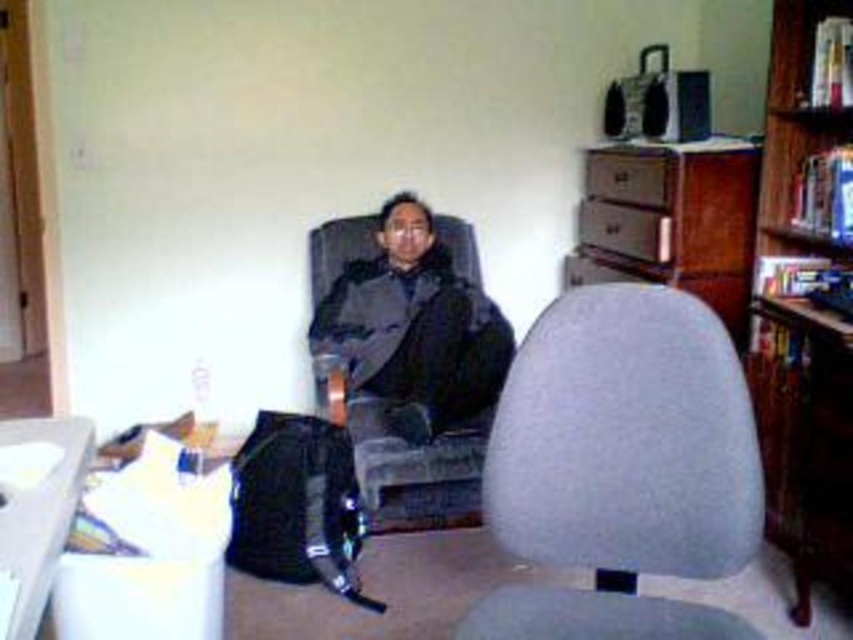
You are a guest entering the room and want to sit down. There is a gray fabric swivel chair at center and a wooden bookshelf at upper right. Which object is closer to you as you enter the room?

The gray fabric swivel chair at center is closer to you because it is in front of the wooden bookshelf at upper right, meaning it is positioned nearer to the entrance where you entered.

You are a person who wants to sit down in the gray fabric swivel chair at center. However, you notice a wooden bookshelf at upper right nearby. Which object is shorter in height?

The gray fabric swivel chair at center is shorter in height compared to the wooden bookshelf at upper right.